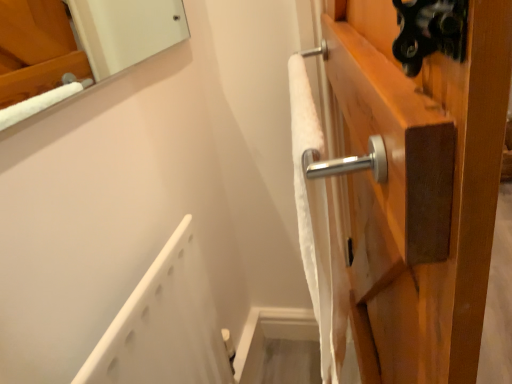
What is the approximate width of satin wood door handle at upper right?

The width of satin wood door handle at upper right is 4.96 feet.

The width and height of the screenshot is (512, 384). Describe the element at coordinates (319, 238) in the screenshot. I see `white soft towel at upper right` at that location.

Image resolution: width=512 pixels, height=384 pixels. Describe the element at coordinates (164, 325) in the screenshot. I see `white plastic bath at lower left` at that location.

Find the location of a particular element. The width and height of the screenshot is (512, 384). satin wood door handle at upper right is located at coordinates click(x=412, y=187).

Considering the points (313, 247) and (177, 269), which point is behind, point (313, 247) or point (177, 269)?

The point (177, 269) is farther from the camera.

Is white soft towel at upper right oriented away from white plastic bath at lower left?

No, white plastic bath at lower left is not at the back of white soft towel at upper right.

From a real-world perspective, between white soft towel at upper right and white plastic bath at lower left, who is vertically higher?

In real-world perspective, white soft towel at upper right is above.

Considering the points (408, 353) and (329, 257), which point is in front, point (408, 353) or point (329, 257)?

The point (408, 353) is closer to the camera.

Considering the positions of objects satin wood door handle at upper right and white soft towel at upper right in the image provided, who is more to the left, satin wood door handle at upper right or white soft towel at upper right?

white soft towel at upper right.

From a real-world perspective, does satin wood door handle at upper right stand above white soft towel at upper right?

No, from a real-world perspective, satin wood door handle at upper right is not on top of white soft towel at upper right.

From the image's perspective, which one is positioned lower, satin wood door handle at upper right or white plastic bath at lower left?

white plastic bath at lower left appears lower in the image.

Consider the image. Is satin wood door handle at upper right positioned beyond the bounds of white plastic bath at lower left?

Yes, satin wood door handle at upper right is not within white plastic bath at lower left.

From a real-world perspective, relative to white plastic bath at lower left, is satin wood door handle at upper right vertically above or below?

satin wood door handle at upper right is below white plastic bath at lower left.

Is white plastic bath at lower left in contact with white soft towel at upper right?

No, white plastic bath at lower left is not in contact with white soft towel at upper right.

Based on the photo, which object is wider, white plastic bath at lower left or white soft towel at upper right?

Wider between the two is white soft towel at upper right.

Is white plastic bath at lower left to the right of white soft towel at upper right from the viewer's perspective?

No, white plastic bath at lower left is not to the right of white soft towel at upper right.

Is white soft towel at upper right a part of white plastic bath at lower left?

Actually, white soft towel at upper right is outside white plastic bath at lower left.

Is white plastic bath at lower left taller or shorter than satin wood door handle at upper right?

A: Considering their sizes, white plastic bath at lower left has more height than satin wood door handle at upper right.

Is satin wood door handle at upper right a part of white plastic bath at lower left?

No, satin wood door handle at upper right is not surrounded by white plastic bath at lower left.

Considering the relative positions of white plastic bath at lower left and satin wood door handle at upper right in the image provided, is white plastic bath at lower left to the left or to the right of satin wood door handle at upper right?

white plastic bath at lower left is positioned on satin wood door handle at upper right's left side.

Which is behind, white plastic bath at lower left or satin wood door handle at upper right?

satin wood door handle at upper right is behind.

Which is correct: white soft towel at upper right is inside satin wood door handle at upper right, or outside of it?

white soft towel at upper right is not enclosed by satin wood door handle at upper right.

Does point (309, 129) come farther from viewer compared to point (362, 292)?

No, (309, 129) is in front of (362, 292).

How much distance is there between white soft towel at upper right and satin wood door handle at upper right?

The distance of white soft towel at upper right from satin wood door handle at upper right is 5.24 inches.

From a real-world perspective, is white soft towel at upper right physically located above or below satin wood door handle at upper right?

white soft towel at upper right is above satin wood door handle at upper right.

Identify the location of bath towel above the white plastic bath at lower left (from a real-world perspective). (319, 238).

Where is `door on the right of white soft towel at upper right`? door on the right of white soft towel at upper right is located at coordinates pyautogui.click(x=412, y=187).

Based on their spatial positions, is satin wood door handle at upper right or white soft towel at upper right further from white plastic bath at lower left?

satin wood door handle at upper right lies further to white plastic bath at lower left than the other object.

When comparing their distances from white soft towel at upper right, does white plastic bath at lower left or satin wood door handle at upper right seem closer?

satin wood door handle at upper right lies closer to white soft towel at upper right than the other object.

From the image, which object appears to be nearer to white plastic bath at lower left, white soft towel at upper right or satin wood door handle at upper right?

Among the two, white soft towel at upper right is located nearer to white plastic bath at lower left.

From the image, which object appears to be farther from satin wood door handle at upper right, white plastic bath at lower left or white soft towel at upper right?

Based on the image, white plastic bath at lower left appears to be further to satin wood door handle at upper right.

Estimate the real-world distances between objects in this image. Which object is closer to white soft towel at upper right, satin wood door handle at upper right or white plastic bath at lower left?

satin wood door handle at upper right.

Considering their positions, is white soft towel at upper right positioned closer to satin wood door handle at upper right than white plastic bath at lower left?

white soft towel at upper right.

Identify the location of bath towel between white plastic bath at lower left and satin wood door handle at upper right. (319, 238).